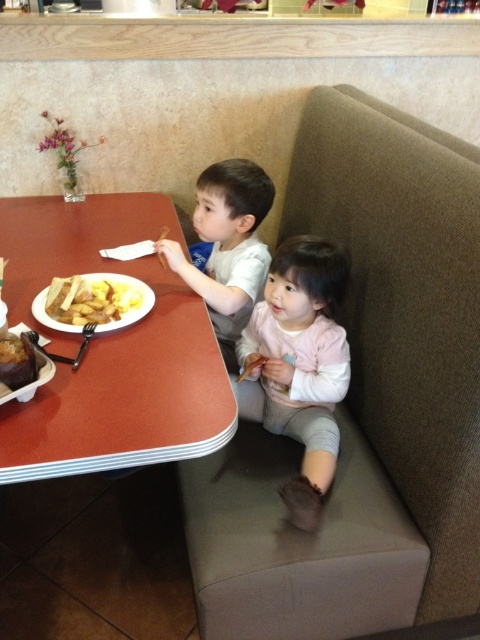
Question: Which object is the closest to the light pink fabric children at lower center?

Choices:
 (A) golden brown bread at table left
 (B) smooth red table at center
 (C) matte white shirt at upper center

Answer: (C)

Question: Among these points, which one is nearest to the camera?

Choices:
 (A) (307, 419)
 (B) (0, 355)
 (C) (10, 285)
 (D) (264, 248)

Answer: (B)

Question: Which of these objects is positioned closest to the smooth red table at center?

Choices:
 (A) light pink fabric children at lower center
 (B) golden brown bread at table left
 (C) pale pink fleece at lower center
 (D) yellow matte scrambled eggs at table left

Answer: (D)

Question: Is light pink fabric children at lower center smaller than matte white shirt at upper center?

Choices:
 (A) no
 (B) yes

Answer: (A)

Question: Observing the image, what is the correct spatial positioning of yellow matte scrambled eggs at table left in reference to golden brown bread at table left?

Choices:
 (A) below
 (B) above

Answer: (B)

Question: Does smooth red table at center appear on the left side of pale pink fleece at lower center?

Choices:
 (A) no
 (B) yes

Answer: (B)